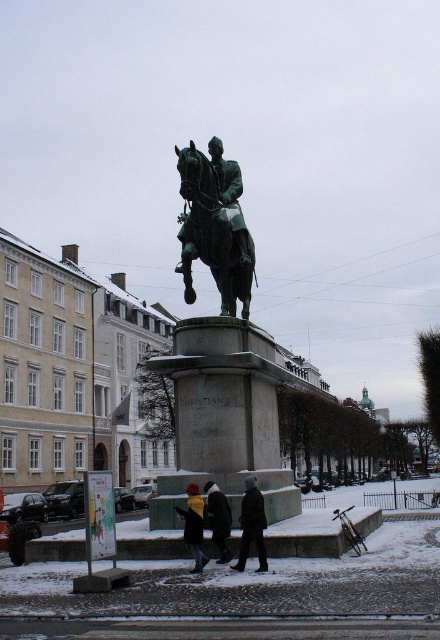
You are a photographer standing in the public square with the statue of Christian IX. You want to take a photo that includes both the statue and a pedestrian near the statue. There are two points marked in the scene. One is at point (244, 288) and the other is at point (231, 522). Which point is closer to the statue?

Point (244, 288) is further to the camera than point (231, 522), so the point closer to the statue is point (231, 522).

You are a photographer trying to capture a photo of the statue and its surroundings. You notice two people wearing the yellow wool sweater at lower center and the black wool coat at center. Which person is standing more to the left side of the statue?

The yellow wool sweater at lower center is positioned on the left side of black wool coat at center, so the person wearing the yellow wool sweater at lower center is standing more to the left side of the statue.